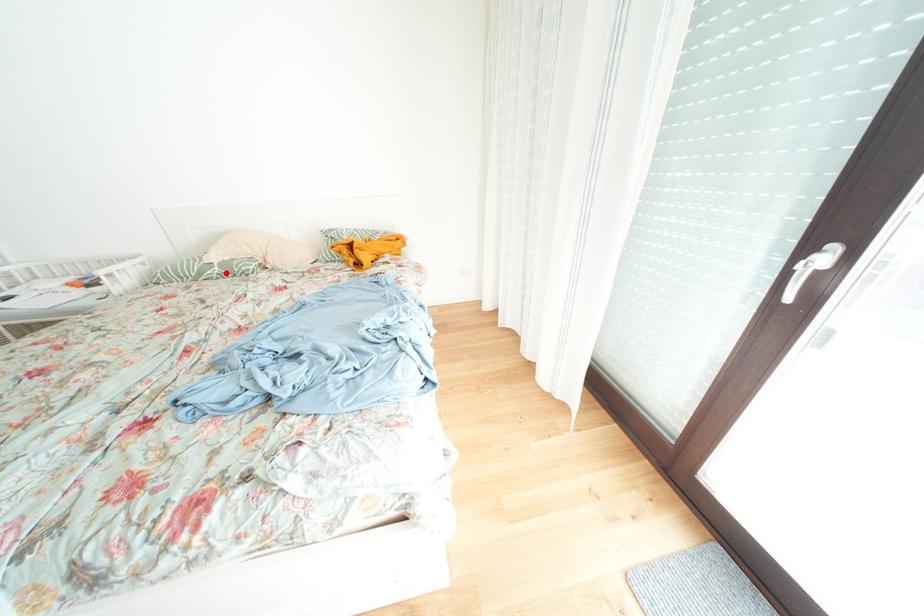
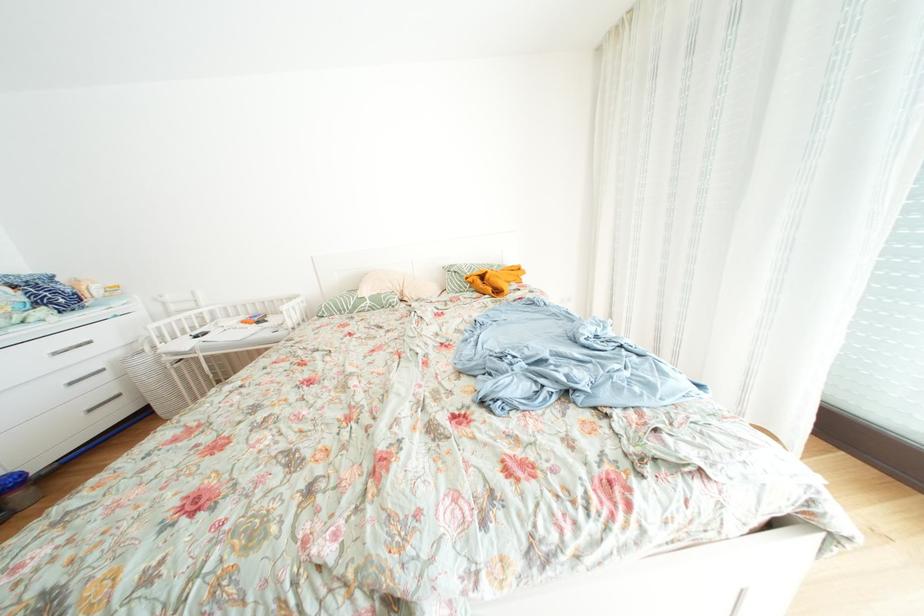
Where in the second image is the point corresponding to the highlighted location from the first image?

(378, 307)